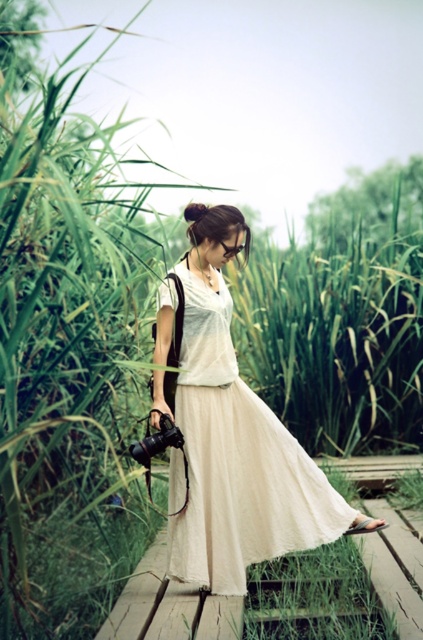
Question: Is light beige cotton dress at center wider than black matte camera at lower left?

Choices:
 (A) yes
 (B) no

Answer: (A)

Question: Observing the image, what is the correct spatial positioning of light beige cotton dress at center in reference to black matte camera at lower left?

Choices:
 (A) below
 (B) above

Answer: (B)

Question: Which point is closer to the camera?

Choices:
 (A) light beige cotton dress at center
 (B) black matte camera at lower left

Answer: (B)

Question: Is light beige cotton dress at center above black matte camera at lower left?

Choices:
 (A) no
 (B) yes

Answer: (B)

Question: Which object appears farthest from the camera in this image?

Choices:
 (A) light beige cotton dress at center
 (B) black matte camera at lower left

Answer: (A)